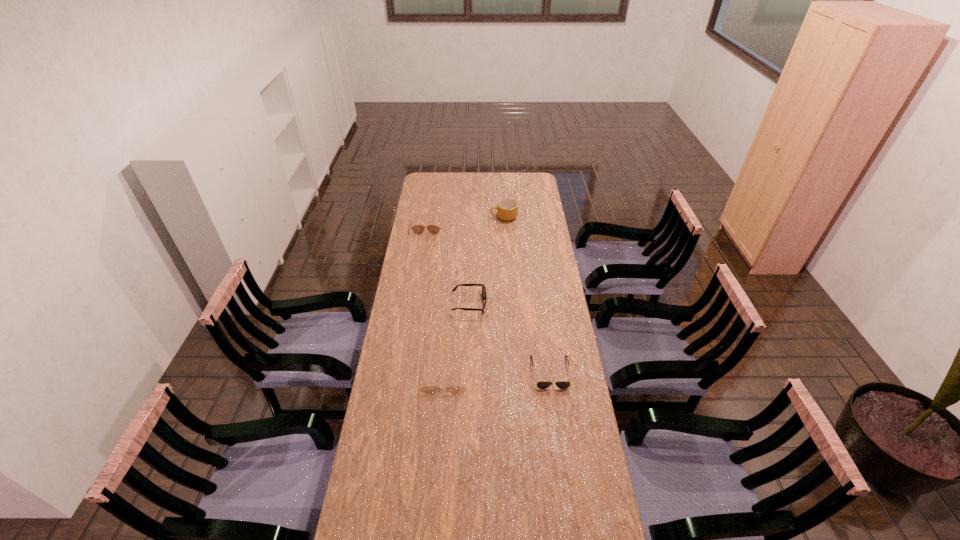
Locate an element on the screen. free space between the rightmost sunglasses and the third nearest sunglasses is located at coordinates (510, 338).

Identify the location of object that can be found as the fourth closest to the tallest object. (427, 389).

At what (x,y) coordinates should I click in order to perform the action: click on the fourth closest object to the farthest sunglasses. Please return your answer as a coordinate pair (x, y). Image resolution: width=960 pixels, height=540 pixels. Looking at the image, I should click on (541, 384).

Identify the location of sunglasses that is the second closest one to the rightmost sunglasses. (484, 296).

The image size is (960, 540). Find the location of `the closest sunglasses to the rightmost sunglasses`. the closest sunglasses to the rightmost sunglasses is located at coordinates (427, 389).